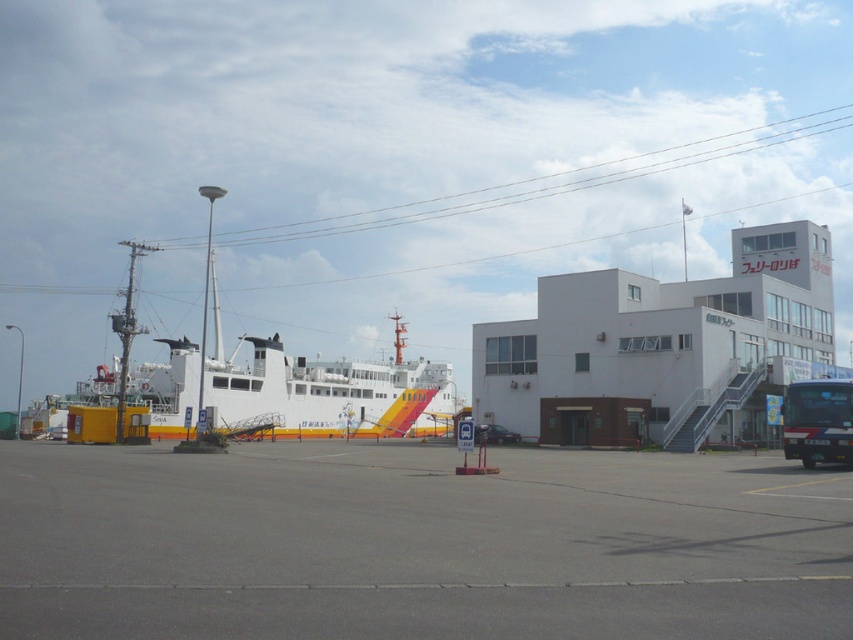
You are a tourist standing at the ferry terminal and want to take a photo of the gray asphalt parking lot at center and the green matte bus at lower right. Which object will appear larger in your photo?

The gray asphalt parking lot at center is taller than the green matte bus at lower right, so it will appear larger in the photo.

You are a delivery driver who needs to park your truck in the gray asphalt parking lot at center. However, there is a shiny black car at center blocking the entrance. Based on the scene, can you drive your truck into the parking lot?

The gray asphalt parking lot at center is located above the shiny black car at center, so you can drive your truck into the parking lot by going over the shiny black car at center since it is positioned below the parking lot entrance.

You are a tour guide explaining the ferry terminal to visitors. You point out the gray asphalt parking lot at center and the green matte bus at lower right. Which one occupies more space in the scene?

The gray asphalt parking lot at center is larger in size than the green matte bus at lower right, so it occupies more space in the scene.